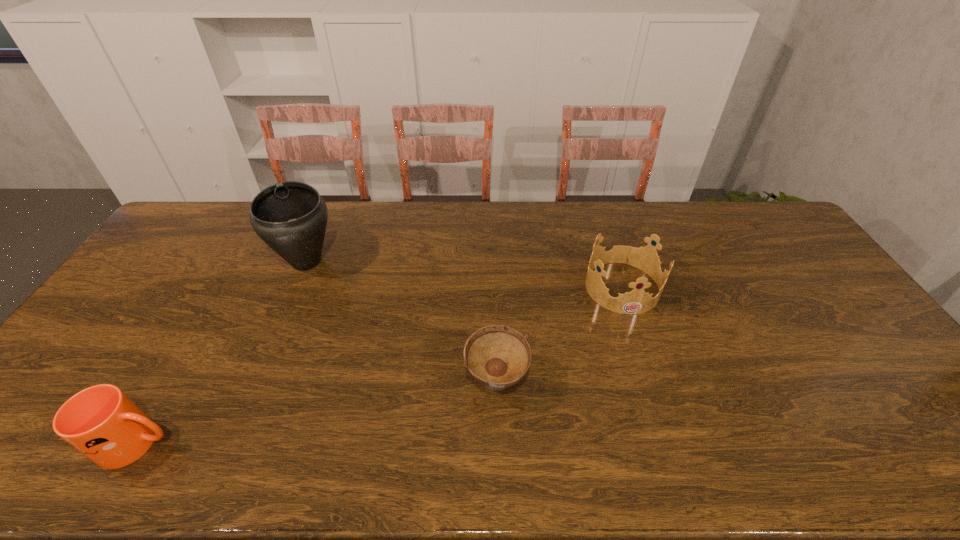
I want to click on object that is the third closest to the second object from left to right, so [637, 301].

You are a GUI agent. You are given a task and a screenshot of the screen. Output one action in this format:
    pyautogui.click(x=<x>, y=<y>)
    Task: Click on the free region that satisfies the following two spatial constraints: 1. on the front-facing side of the tiara; 2. on the handle side of the mug
    Image resolution: width=960 pixels, height=540 pixels.
    Given the screenshot: What is the action you would take?
    pyautogui.click(x=673, y=443)